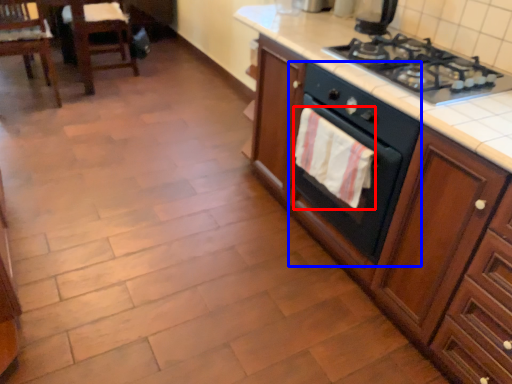
Question: Among these objects, which one is farthest to the camera, hand towel (highlighted by a red box) or oven (highlighted by a blue box)?

Choices:
 (A) hand towel
 (B) oven

Answer: (A)